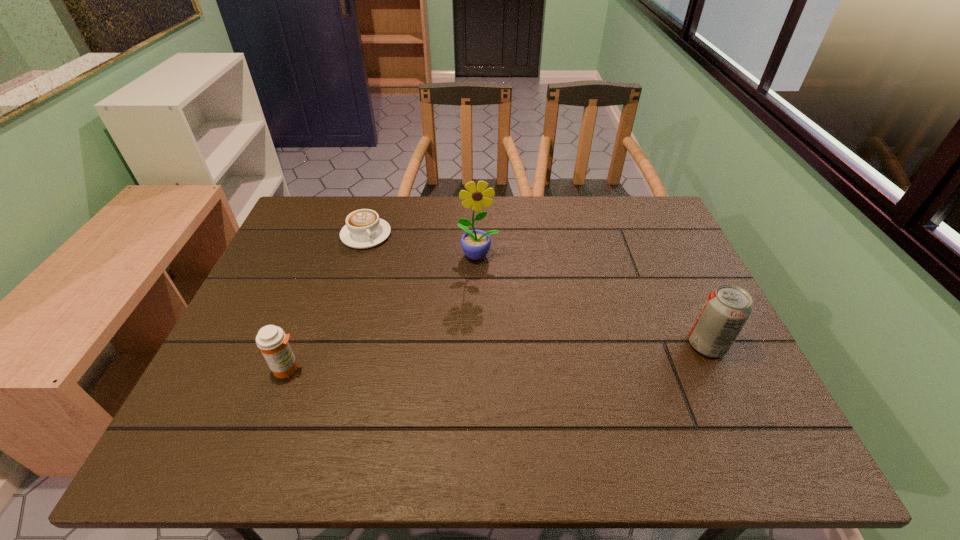
This screenshot has height=540, width=960. In order to click on free spot on the desktop that is between the medicine and the rightmost object and is positioned with the handle on the right side of the cappuccino in this screenshot , I will do `click(464, 359)`.

Locate an element on the screen. vacant space on the desktop that is between the medicine and the soda can and is positioned on the front-facing side of the sunflower is located at coordinates (491, 357).